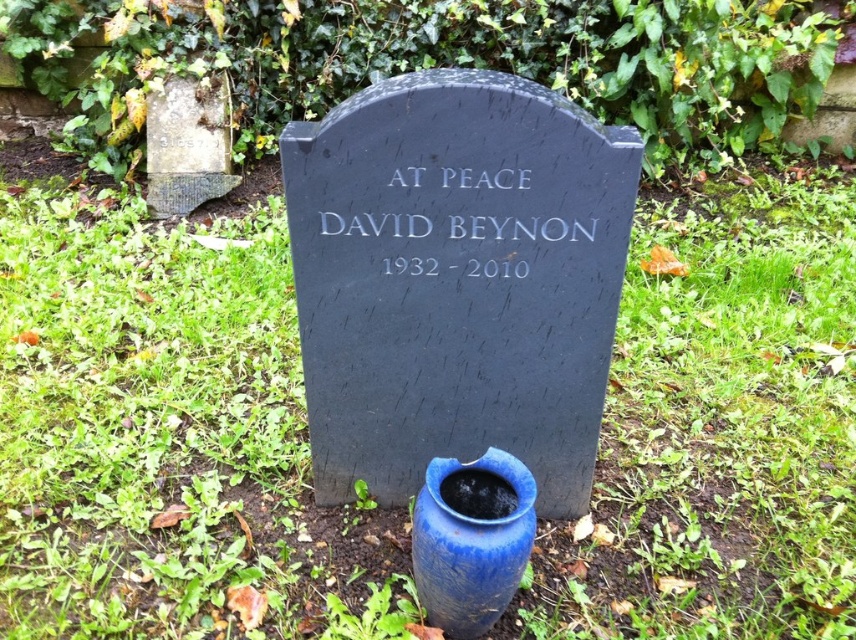
You are standing in a cemetery and see the green grass at center and the weathered stone gravestone at upper left. Which object is taller?

The green grass at center is taller than the weathered stone gravestone at upper left.

You are standing at the entrance of the cemetery and see the blue glazed vase at center and the weathered stone gravestone at upper left. Which object is closer to the ground?

The blue glazed vase at center is below weathered stone gravestone at upper left, so it is closer to the ground.

You are standing in front of the gravestone and want to place a small flower at the point closest to you between point A at point (275,273) and point B at point (158,209). Which point should you choose?

You should choose point A at point (275,273) because it is closer to you than point B at point (158,209).